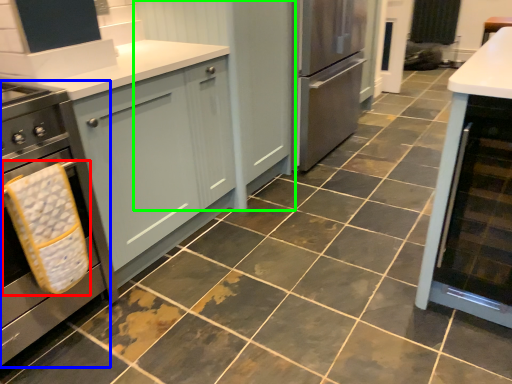
Question: Which object is positioned closest to material (highlighted by a red box)? Select from home appliance (highlighted by a blue box) and cabinetry (highlighted by a green box).

Choices:
 (A) home appliance
 (B) cabinetry

Answer: (A)